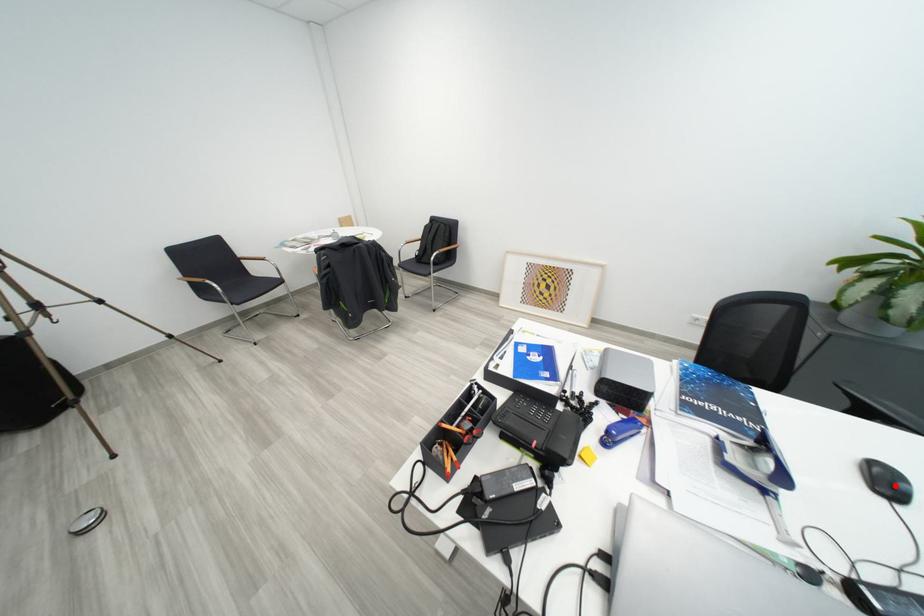
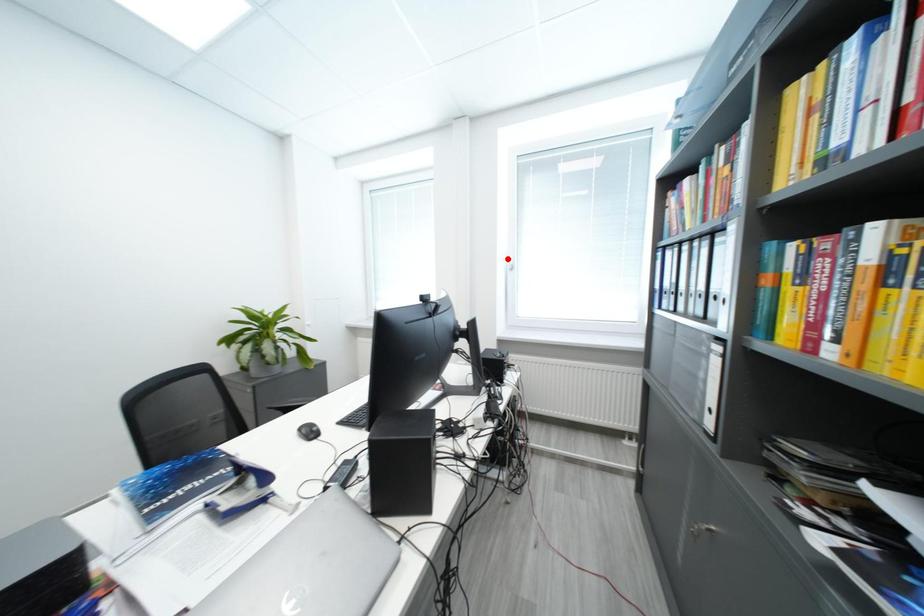
I am providing you with two images of the same scene from different viewpoints. A red point is marked on the first image and another point is marked on the second image. Is the red point in image1 aligned with the point shown in image2?

No